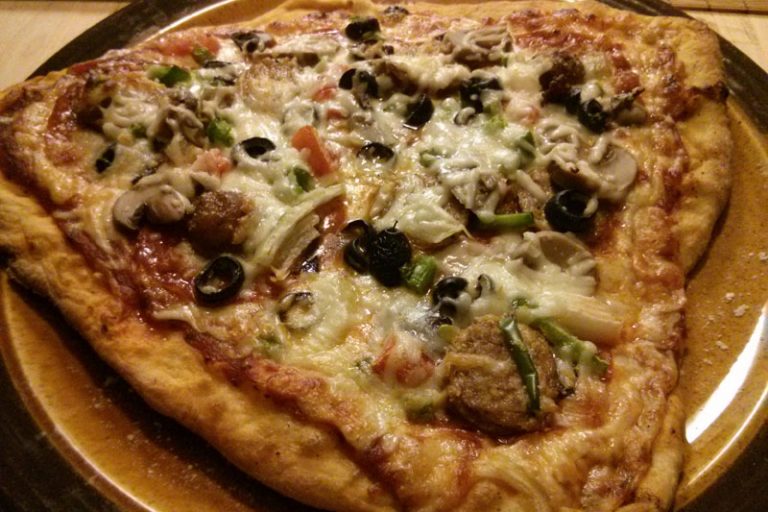
The width and height of the screenshot is (768, 512). Identify the location of beige surface. (45, 28), (733, 29).